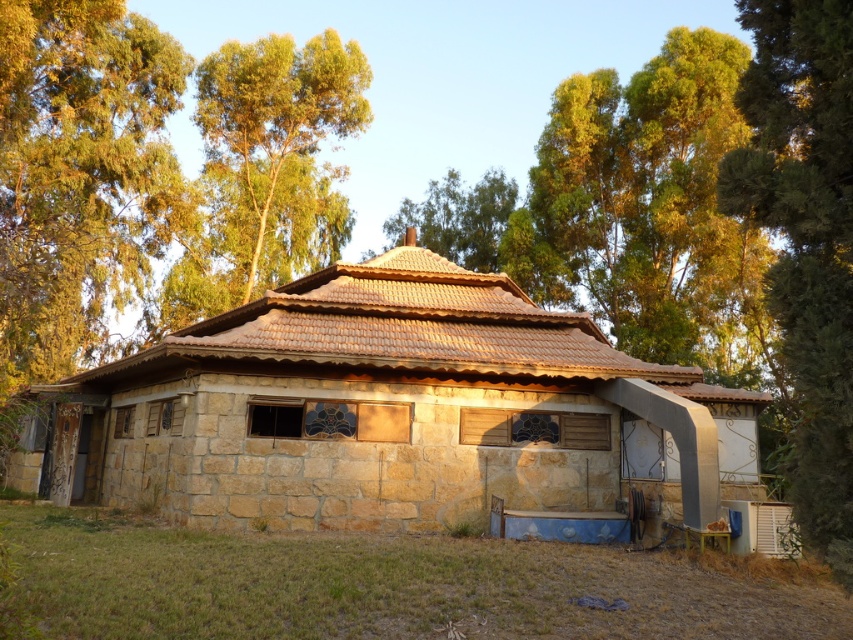
Question: Does brown stone hut at center have a greater width compared to green leafy tree at right?

Choices:
 (A) yes
 (B) no

Answer: (A)

Question: In this image, where is green leafy tree at right located relative to green leafy tree at upper left?

Choices:
 (A) below
 (B) above

Answer: (A)

Question: Which point is closer to the camera taking this photo?

Choices:
 (A) (846, 186)
 (B) (322, 83)
 (C) (379, 365)

Answer: (A)

Question: Which object is closer to the camera taking this photo?

Choices:
 (A) green leafy tree at right
 (B) brown stone hut at center
 (C) green leafy tree at upper left

Answer: (A)

Question: Does brown stone hut at center come in front of green leafy tree at right?

Choices:
 (A) no
 (B) yes

Answer: (A)

Question: Among these points, which one is farthest from the camera?

Choices:
 (A) (833, 564)
 (B) (305, 376)
 (C) (256, 124)

Answer: (C)